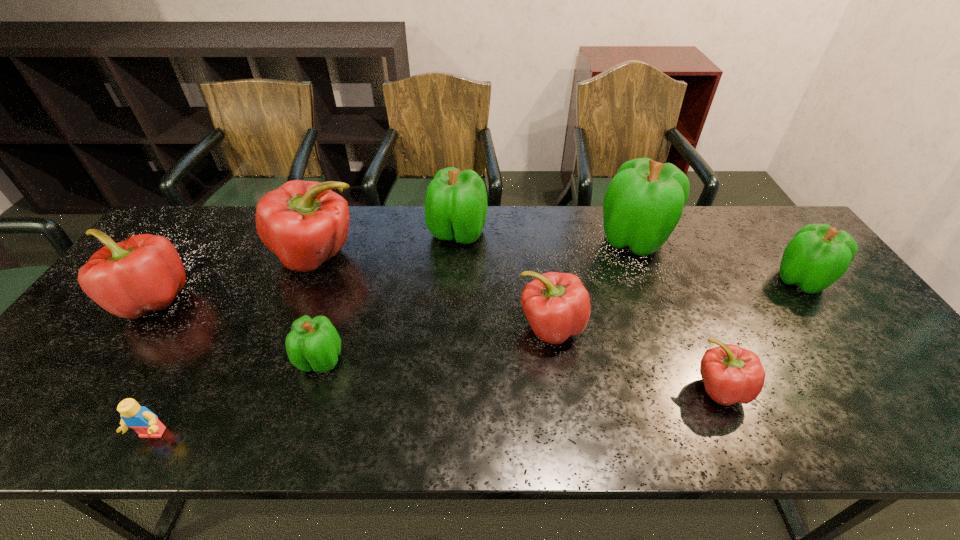
The height and width of the screenshot is (540, 960). Identify the location of vacant space that satisfies the following two spatial constraints: 1. on the front side of the rightmost green bell pepper; 2. on the right side of the second pink bell pepper from left to right. tap(308, 280).